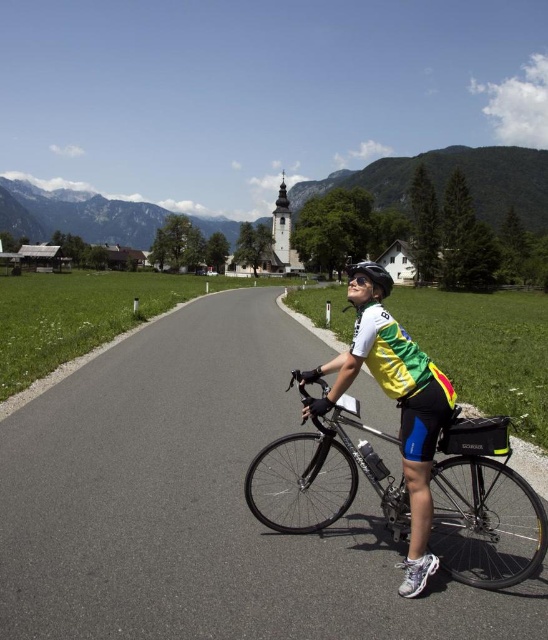
Measure the distance between point (385,468) and camera.

4.74 meters

Is shiny black bicycle at center further to the viewer compared to matte black helmet at center?

No.

Which is behind, point (447, 525) or point (370, 280)?

Point (370, 280)

Find the location of a particular element. The height and width of the screenshot is (640, 548). shiny black bicycle at center is located at coordinates point(483,492).

Which is more to the left, yellow/reflective fabric cyclist at center or matte black helmet at center?

yellow/reflective fabric cyclist at center is more to the left.

Who is higher up, yellow/reflective fabric cyclist at center or matte black helmet at center?

Positioned higher is matte black helmet at center.

Locate an element on the screen. yellow/reflective fabric cyclist at center is located at coordinates (399, 408).

Is yellow/reflective fabric cyclist at center to the left of shiny black bicycle at center from the viewer's perspective?

Incorrect, yellow/reflective fabric cyclist at center is not on the left side of shiny black bicycle at center.

Who is shorter, yellow/reflective fabric cyclist at center or shiny black bicycle at center?

With less height is yellow/reflective fabric cyclist at center.

Where is `yellow/reflective fabric cyclist at center`? The image size is (548, 640). yellow/reflective fabric cyclist at center is located at coordinates (399, 408).